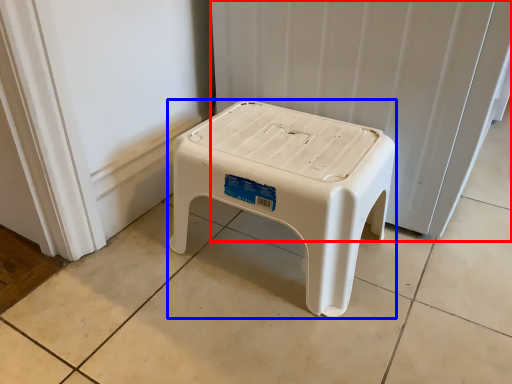
Question: Which of the following is the closest to the observer, radiator (highlighted by a red box) or stool (highlighted by a blue box)?

Choices:
 (A) radiator
 (B) stool

Answer: (B)